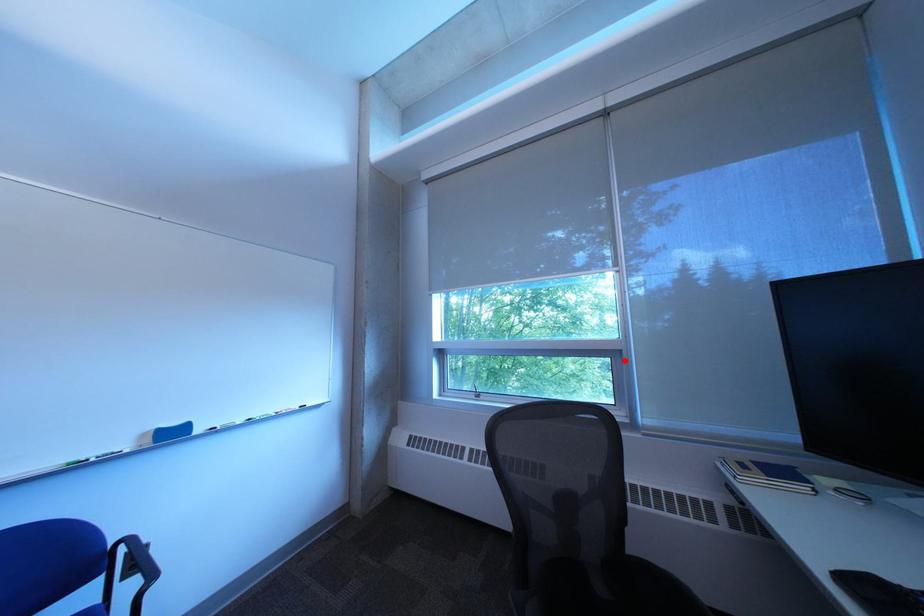
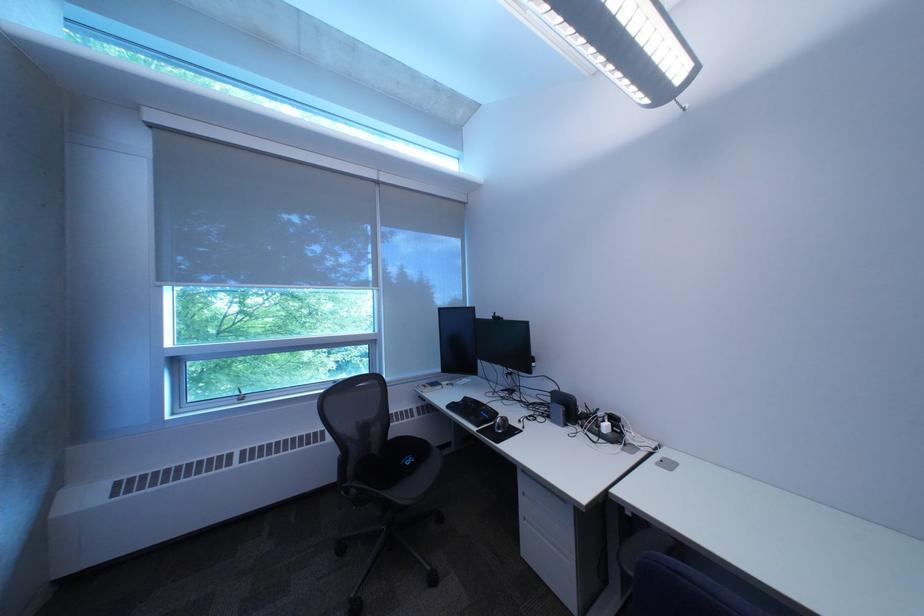
Question: I am providing you with two images of the same scene from different viewpoints. A red point is shown in image1. For the corresponding object point in image2, is it positioned nearer or farther from the camera?

Choices:
 (A) Nearer
 (B) Farther

Answer: (A)